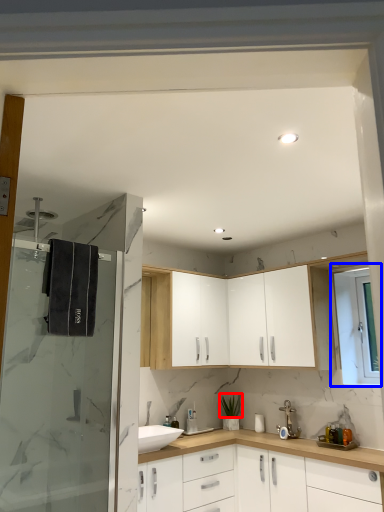
Question: Among these objects, which one is farthest to the camera, plant (highlighted by a red box) or window (highlighted by a blue box)?

Choices:
 (A) plant
 (B) window

Answer: (A)